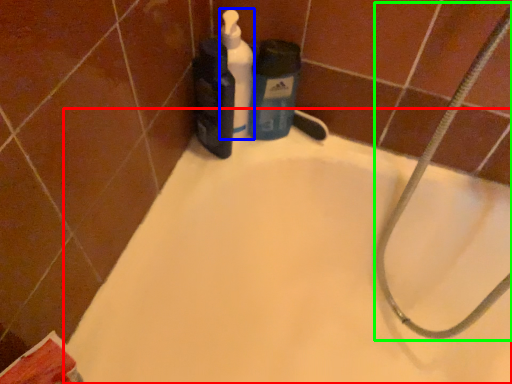
Question: Estimate the real-world distances between objects in this image. Which object is farther from bathtub (highlighted by a red box), cleaning product (highlighted by a blue box) or garden hose (highlighted by a green box)?

Choices:
 (A) cleaning product
 (B) garden hose

Answer: (A)